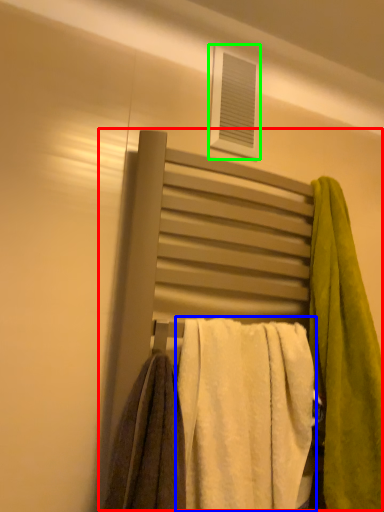
Question: Considering the real-world distances, which object is closest to bed (highlighted by a red box)? towel (highlighted by a blue box) or window (highlighted by a green box).

Choices:
 (A) towel
 (B) window

Answer: (A)